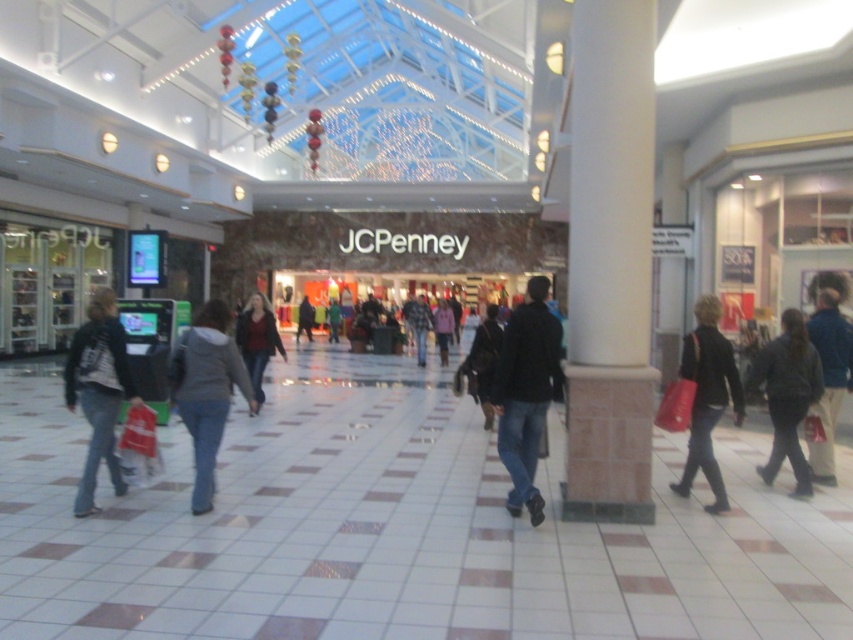
You are a delivery person carrying a large box that is 2 meters wide. You need to walk through the mall area near the JCPenney store. Can the white tile floor at center accommodate your box since it is wider than the green fabric jacket at center?

The white tile floor at center is wider than the green fabric jacket at center, so the 2 meter wide box should fit as long as there is enough space on the floor.